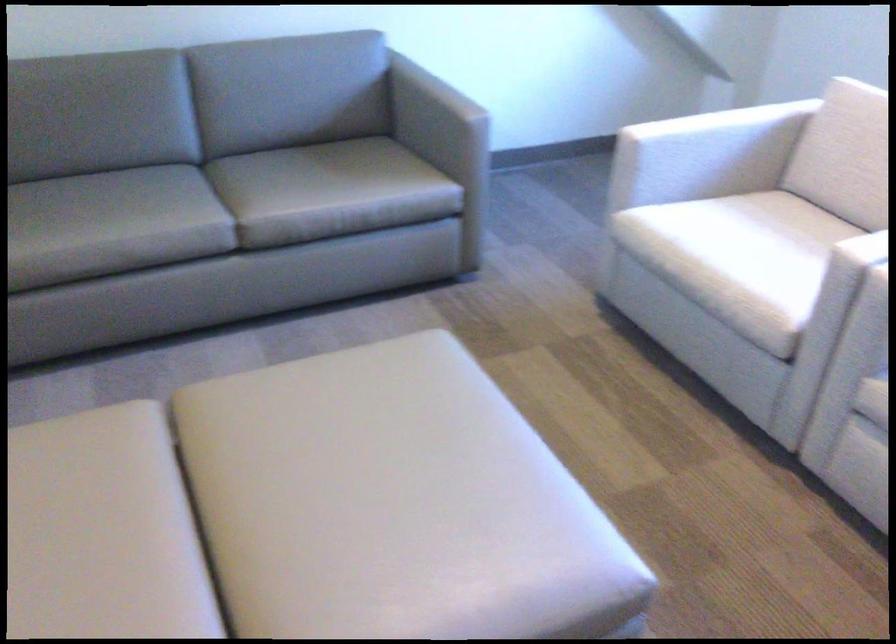
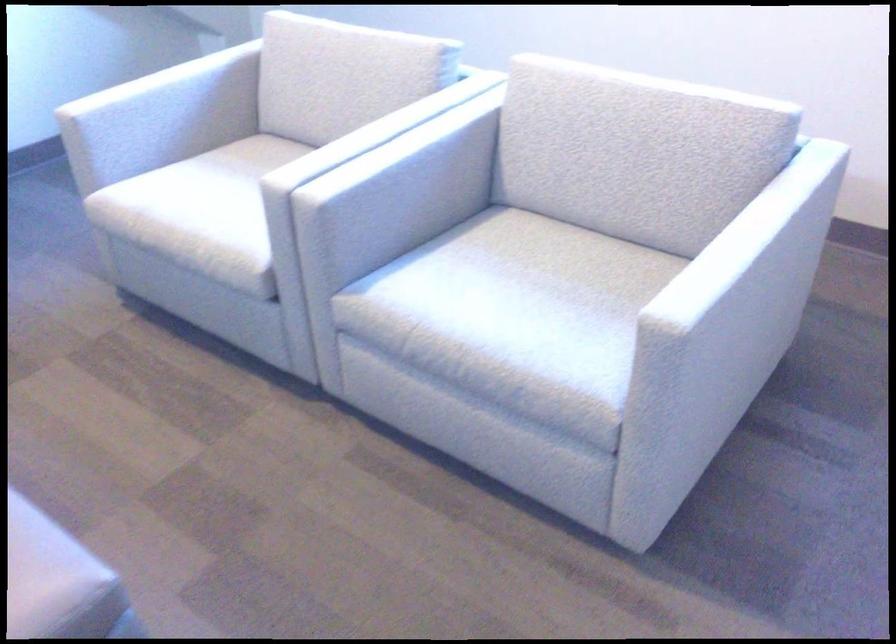
Question: The camera is either moving clockwise (left) or counter-clockwise (right) around the object. The first image is from the beginning of the video and the second image is from the end. Is the camera moving left or right when shooting the video?

Choices:
 (A) Left
 (B) Right

Answer: (A)